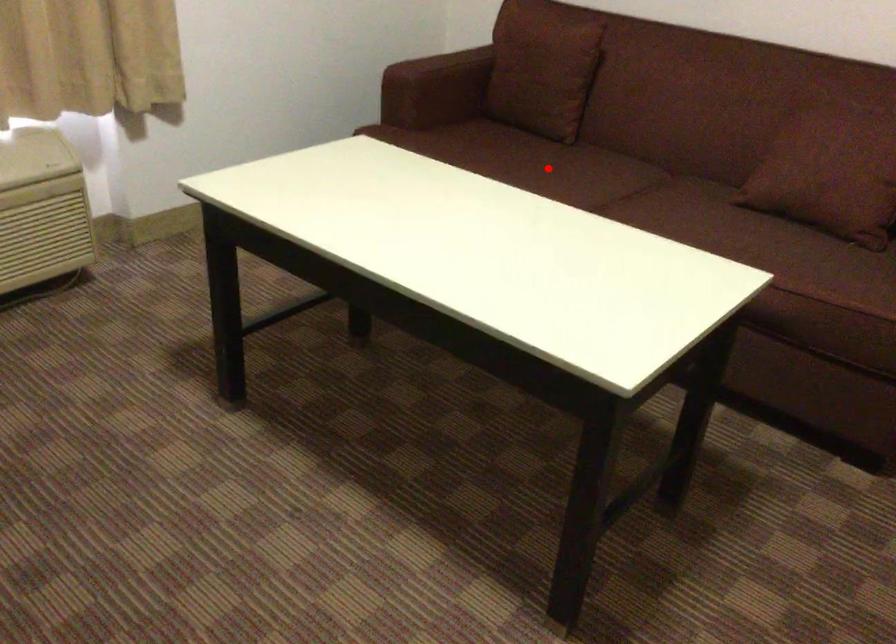
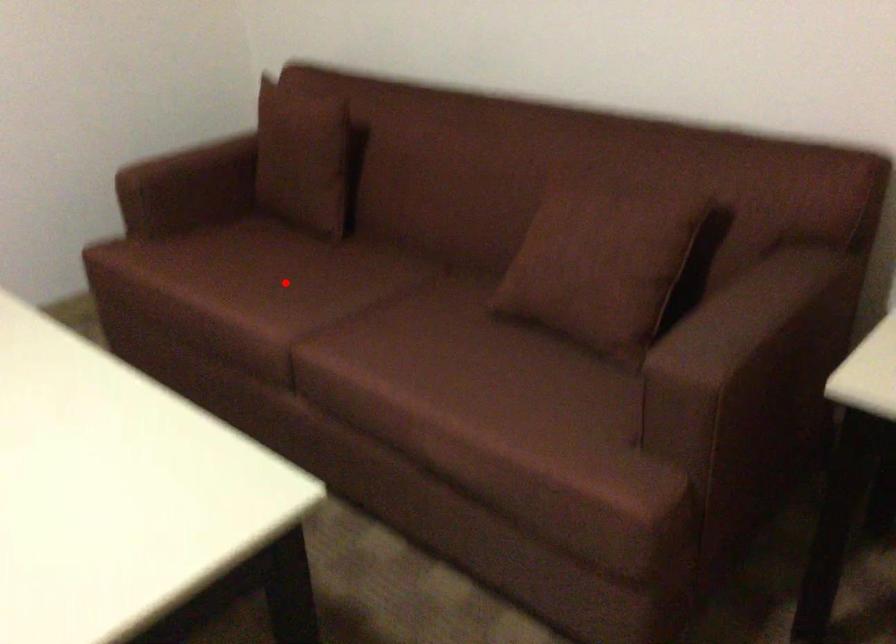
I am providing you with two images of the same scene from different viewpoints. A red point is marked on the first image and another point is marked on the second image. Does the point marked in image1 correspond to the same location as the one in image2?

Yes